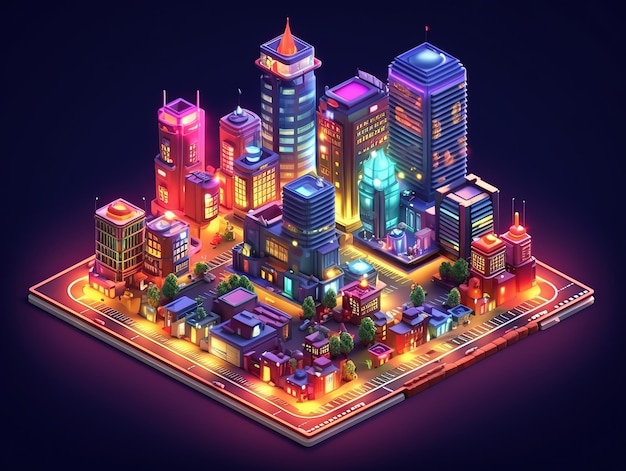
Identify the location of game playing board. The image size is (626, 471). (315, 414).